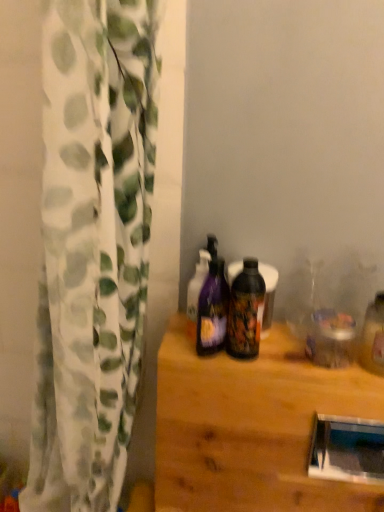
Question: From the image's perspective, is glossy plastic bottle at center, which is the 2th bottle in left-to-right order, above white textured curtain at left?

Choices:
 (A) no
 (B) yes

Answer: (B)

Question: Are glossy plastic bottle at center, which is the 2th bottle in left-to-right order, and white textured curtain at left far apart?

Choices:
 (A) yes
 (B) no

Answer: (B)

Question: From the image's perspective, is glossy plastic bottle at center, the first bottle in the right-to-left sequence, located beneath white textured curtain at left?

Choices:
 (A) yes
 (B) no

Answer: (B)

Question: Considering the relative sizes of glossy plastic bottle at center, the first bottle in the right-to-left sequence, and white textured curtain at left in the image provided, is glossy plastic bottle at center, the first bottle in the right-to-left sequence, smaller than white textured curtain at left?

Choices:
 (A) yes
 (B) no

Answer: (A)

Question: Are glossy plastic bottle at center, the first bottle in the right-to-left sequence, and white textured curtain at left beside each other?

Choices:
 (A) no
 (B) yes

Answer: (A)

Question: From the image's perspective, is white textured curtain at left above or below wooden table at center?

Choices:
 (A) above
 (B) below

Answer: (A)

Question: Is point (97, 45) closer or farther from the camera than point (238, 490)?

Choices:
 (A) closer
 (B) farther

Answer: (A)

Question: Which is correct: white textured curtain at left is inside wooden table at center, or outside of it?

Choices:
 (A) inside
 (B) outside

Answer: (B)

Question: From their relative heights in the image, would you say white textured curtain at left is taller or shorter than wooden table at center?

Choices:
 (A) tall
 (B) short

Answer: (A)

Question: From the image's perspective, is glossy plastic bottle at center, which is the 2th bottle in left-to-right order, located above or below white textured curtain at left?

Choices:
 (A) above
 (B) below

Answer: (A)

Question: From a real-world perspective, relative to white textured curtain at left, is glossy plastic bottle at center, the first bottle in the right-to-left sequence, vertically above or below?

Choices:
 (A) above
 (B) below

Answer: (A)

Question: Is glossy plastic bottle at center, the first bottle in the right-to-left sequence, taller or shorter than white textured curtain at left?

Choices:
 (A) tall
 (B) short

Answer: (B)

Question: Considering the positions of point (230, 289) and point (112, 485), is point (230, 289) closer or farther from the camera than point (112, 485)?

Choices:
 (A) closer
 (B) farther

Answer: (A)

Question: Would you say glossy plastic bottle at center, which is the 2th bottle in left-to-right order, is inside or outside purple glossy bottle at center, the first bottle from the left?

Choices:
 (A) outside
 (B) inside

Answer: (A)

Question: In terms of size, does glossy plastic bottle at center, the first bottle in the right-to-left sequence, appear bigger or smaller than purple glossy bottle at center, the 2th bottle when ordered from right to left?

Choices:
 (A) big
 (B) small

Answer: (B)